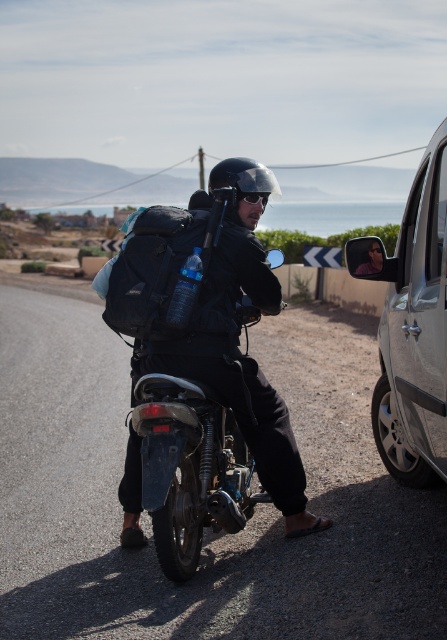
Question: Considering the relative positions of black fabric backpack at center and sunglasses at center in the image provided, where is black fabric backpack at center located with respect to sunglasses at center?

Choices:
 (A) above
 (B) below

Answer: (B)

Question: Which of the following is the closest to the observer?

Choices:
 (A) sunglasses at center
 (B) black matte helmet at center
 (C) matte black motorcycle at center
 (D) black fabric backpack at center

Answer: (C)

Question: Is the position of matte black motorcycle at center less distant than that of black matte helmet at center?

Choices:
 (A) no
 (B) yes

Answer: (B)

Question: Which point is farther to the camera?

Choices:
 (A) silver metallic car at right
 (B) matte black motorcycle at center

Answer: (A)

Question: Which object is the farthest from the sunglasses at center?

Choices:
 (A) silver metallic car at right
 (B) black fabric backpack at center

Answer: (A)

Question: Is black fabric backpack at center positioned behind sunglasses at center?

Choices:
 (A) no
 (B) yes

Answer: (A)